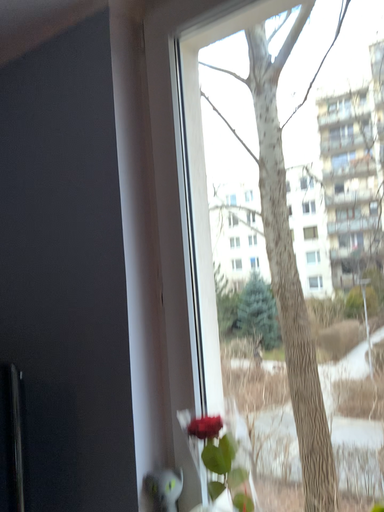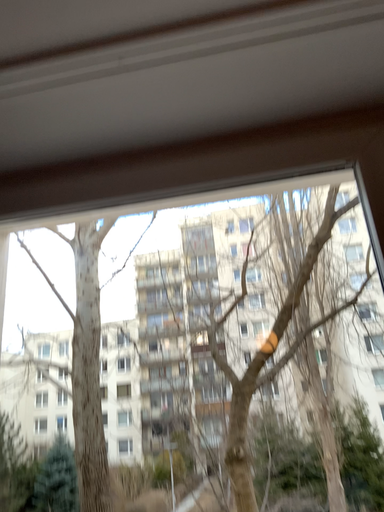
Question: Which way did the camera rotate in the video?

Choices:
 (A) rotated left
 (B) rotated right

Answer: (B)